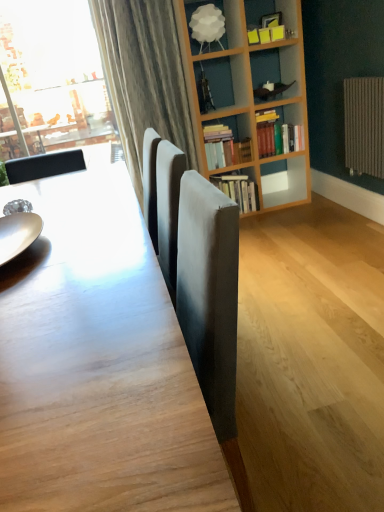
This screenshot has width=384, height=512. What do you see at coordinates (98, 362) in the screenshot?
I see `wooden table at center` at bounding box center [98, 362].

The image size is (384, 512). What do you see at coordinates (210, 26) in the screenshot?
I see `white matte lampshade at upper center` at bounding box center [210, 26].

Locate an element on the screen. The height and width of the screenshot is (512, 384). slightly worn paper book at center, the first book from the bottom is located at coordinates (238, 190).

Is slightly worn paper book at center, the first book from the bottom, not inside shiny silver plate at left?

Yes, slightly worn paper book at center, the first book from the bottom, is located beyond the bounds of shiny silver plate at left.

Find the location of a particular element. plate to the left of slightly worn paper book at center, the first book from the bottom is located at coordinates (18, 234).

Measure the distance between slightly worn paper book at center, which is the third book from top to bottom, and shiny silver plate at left.

slightly worn paper book at center, which is the third book from top to bottom, and shiny silver plate at left are 6.76 feet apart.

From a real-world perspective, is slightly worn paper book at center, which is the third book from top to bottom, above or below shiny silver plate at left?

From a real-world perspective, slightly worn paper book at center, which is the third book from top to bottom, is physically below shiny silver plate at left.

Is point (89, 400) in front of point (218, 42)?

Yes, point (89, 400) is in front of point (218, 42).

From a real-world perspective, which object stands above the other?

white matte lampshade at upper center is physically above.

Considering the relative sizes of wooden table at center and white matte lampshade at upper center in the image provided, is wooden table at center bigger than white matte lampshade at upper center?

Correct, wooden table at center is larger in size than white matte lampshade at upper center.

Based on their sizes in the image, would you say hardcover books at center, arranged as the first book when viewed from the top, is bigger or smaller than shiny silver plate at left?

In the image, hardcover books at center, arranged as the first book when viewed from the top, appears to be larger than shiny silver plate at left.

Is shiny silver plate at left a part of hardcover books at center, arranged as the first book when viewed from the top?

Actually, shiny silver plate at left is outside hardcover books at center, arranged as the first book when viewed from the top.

Can you confirm if hardcover books at center, arranged as the first book when viewed from the top, is shorter than shiny silver plate at left?

No, hardcover books at center, arranged as the first book when viewed from the top, is not shorter than shiny silver plate at left.

Does point (271, 127) lie behind point (9, 241)?

That is True.

From a real-world perspective, who is located higher, hardcover books at upper right, the second book from the top, or hardcover books at center, arranged as the first book when viewed from the top?

hardcover books at center, arranged as the first book when viewed from the top, from a real-world perspective.

From the image's perspective, would you say hardcover books at upper right, the second book from the bottom, is shown under hardcover books at center, arranged as the first book when viewed from the top?

Yes, from the image's perspective, hardcover books at upper right, the second book from the bottom, is beneath hardcover books at center, arranged as the first book when viewed from the top.

Can you confirm if hardcover books at upper right, the second book from the top, is smaller than hardcover books at center, arranged as the first book when viewed from the top?

Correct, hardcover books at upper right, the second book from the top, occupies less space than hardcover books at center, arranged as the first book when viewed from the top.

Is the position of hardcover books at upper right, the second book from the top, more distant than that of hardcover books at center, which ranks as the third book in bottom-to-top order?

No, it is in front of hardcover books at center, which ranks as the third book in bottom-to-top order.

Is white matte lampshade at upper center not inside hardcover books at upper right, the second book from the top?

Yes, white matte lampshade at upper center is not within hardcover books at upper right, the second book from the top.

Is white matte lampshade at upper center facing away from hardcover books at upper right, the second book from the bottom?

No, hardcover books at upper right, the second book from the bottom, is not at the back of white matte lampshade at upper center.

Identify the location of book that is the 1st object to the right of the white matte lampshade at upper center, starting at the anchor. (224, 147).

Considering the relative sizes of shiny silver plate at left and slightly worn paper book at center, the first book from the bottom, in the image provided, is shiny silver plate at left bigger than slightly worn paper book at center, the first book from the bottom,?

Actually, shiny silver plate at left might be smaller than slightly worn paper book at center, the first book from the bottom.

Is shiny silver plate at left wider than slightly worn paper book at center, the first book from the bottom?

In fact, shiny silver plate at left might be narrower than slightly worn paper book at center, the first book from the bottom.

From a real-world perspective, is shiny silver plate at left positioned over slightly worn paper book at center, the first book from the bottom, based on gravity?

Correct, in the physical world, shiny silver plate at left is higher than slightly worn paper book at center, the first book from the bottom.

Consider the image. Is shiny silver plate at left facing away from slightly worn paper book at center, the first book from the bottom?

No, slightly worn paper book at center, the first book from the bottom, is not at the back of shiny silver plate at left.

Based on the photo, is hardcover books at center, arranged as the first book when viewed from the top, located outside slightly worn paper book at center, which is the third book from top to bottom?

hardcover books at center, arranged as the first book when viewed from the top, is positioned outside slightly worn paper book at center, which is the third book from top to bottom.

Between hardcover books at center, which ranks as the third book in bottom-to-top order, and slightly worn paper book at center, the first book from the bottom, which one has less height?

hardcover books at center, which ranks as the third book in bottom-to-top order, is shorter.

From a real-world perspective, is hardcover books at center, arranged as the first book when viewed from the top, physically below slightly worn paper book at center, which is the third book from top to bottom?

No, from a real-world perspective, hardcover books at center, arranged as the first book when viewed from the top, is not under slightly worn paper book at center, which is the third book from top to bottom.

At what (x,y) coordinates should I click in order to perform the action: click on plate in front of the slightly worn paper book at center, the first book from the bottom. Please return your answer as a coordinate pair (x, y). Looking at the image, I should click on (18, 234).

The width and height of the screenshot is (384, 512). I want to click on shelf above the wooden table at center (from the image's perspective), so click(210, 26).

Based on the photo, considering their positions, is hardcover books at center, which ranks as the third book in bottom-to-top order, positioned closer to white matte lampshade at upper center than hardcover books at upper right, the second book from the top?

The object closer to white matte lampshade at upper center is hardcover books at upper right, the second book from the top.

Considering their positions, is slightly worn paper book at center, the first book from the bottom, positioned further to hardcover books at center, arranged as the first book when viewed from the top, than wooden table at center?

wooden table at center lies further to hardcover books at center, arranged as the first book when viewed from the top, than the other object.

Considering their positions, is slightly worn paper book at center, the first book from the bottom, positioned closer to white matte lampshade at upper center than wooden table at center?

slightly worn paper book at center, the first book from the bottom, is positioned closer to the anchor white matte lampshade at upper center.

Looking at the image, which one is located closer to wooden table at center, hardcover books at center, arranged as the first book when viewed from the top, or shiny silver plate at left?

The object closer to wooden table at center is shiny silver plate at left.

Based on the photo, looking at the image, which one is located closer to white matte lampshade at upper center, shiny silver plate at left or slightly worn paper book at center, which is the third book from top to bottom?

Based on the image, slightly worn paper book at center, which is the third book from top to bottom, appears to be nearer to white matte lampshade at upper center.

Estimate the real-world distances between objects in this image. Which object is closer to hardcover books at center, arranged as the first book when viewed from the top, wooden table at center or white matte lampshade at upper center?

Based on the image, white matte lampshade at upper center appears to be nearer to hardcover books at center, arranged as the first book when viewed from the top.

Based on their spatial positions, is wooden table at center or slightly worn paper book at center, the first book from the bottom, closer to hardcover books at upper right, the second book from the bottom?

slightly worn paper book at center, the first book from the bottom, is positioned closer to the anchor hardcover books at upper right, the second book from the bottom.

Consider the image. Considering their positions, is shiny silver plate at left positioned closer to hardcover books at center, which ranks as the third book in bottom-to-top order, than slightly worn paper book at center, the first book from the bottom?

slightly worn paper book at center, the first book from the bottom.

You are a GUI agent. You are given a task and a screenshot of the screen. Output one action in this format:
    pyautogui.click(x=<x>, y=<y>)
    Task: Click on the shelf positioned between wooden table at center and slightly worn paper book at center, which is the third book from top to bottom, from near to far
    The width and height of the screenshot is (384, 512).
    Given the screenshot: What is the action you would take?
    pyautogui.click(x=210, y=26)

You are a GUI agent. You are given a task and a screenshot of the screen. Output one action in this format:
    pyautogui.click(x=<x>, y=<y>)
    Task: Click on the shelf between shiny silver plate at left and hardcover books at center, which ranks as the third book in bottom-to-top order, in the front-back direction
    The image size is (384, 512).
    Given the screenshot: What is the action you would take?
    pyautogui.click(x=210, y=26)

I want to click on book positioned between wooden table at center and hardcover books at center, which ranks as the third book in bottom-to-top order, from near to far, so click(x=224, y=147).

At what (x,y) coordinates should I click in order to perform the action: click on book that lies between white matte lampshade at upper center and hardcover books at upper right, the second book from the top, from top to bottom. Please return your answer as a coordinate pair (x, y). Looking at the image, I should click on (277, 135).